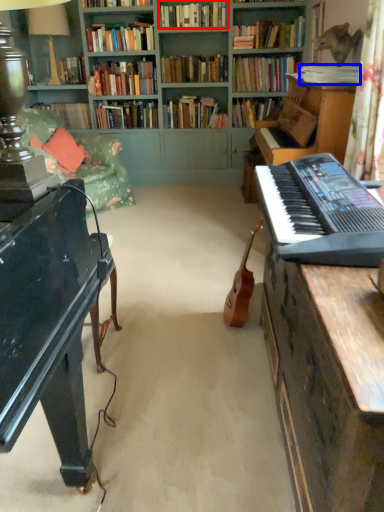
Question: Among these objects, which one is nearest to the camera, book (highlighted by a red box) or book (highlighted by a blue box)?

Choices:
 (A) book
 (B) book

Answer: (B)